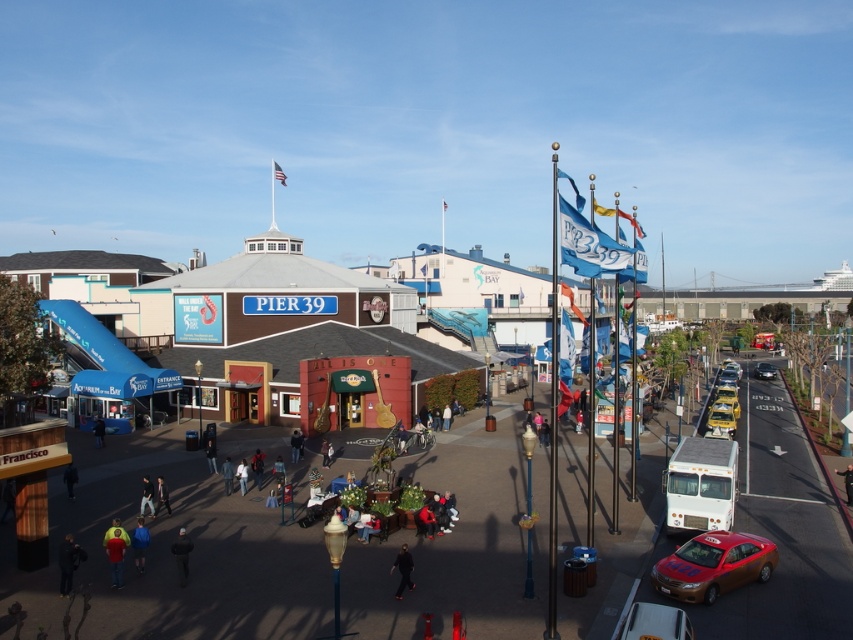
Is point (120, 556) positioned after point (753, 371)?

No.

Is point (114, 541) in front of point (764, 371)?

Yes, it is in front of point (764, 371).

Is point (109, 556) less distant than point (764, 376)?

Yes, it is.

You are a GUI agent. You are given a task and a screenshot of the screen. Output one action in this format:
    pyautogui.click(x=<x>, y=<y>)
    Task: Click on the yellow fabric jacket at lower left
    The image size is (853, 640).
    Given the screenshot: What is the action you would take?
    pyautogui.click(x=115, y=556)

Which of these two, shiny red car at lower right or black fabric jacket at lower left, stands shorter?

shiny red car at lower right

Does point (666, 563) lie behind point (178, 568)?

No, it is not.

Where is `shiny red car at lower right`? The image size is (853, 640). shiny red car at lower right is located at coordinates (712, 564).

Is shiny red car at lower right smaller than metallic silver car at lower right?

No, shiny red car at lower right is not smaller than metallic silver car at lower right.

This screenshot has width=853, height=640. What are the coordinates of `shiny red car at lower right` in the screenshot? It's located at (712, 564).

Identify the location of shiny red car at lower right. The width and height of the screenshot is (853, 640). (712, 564).